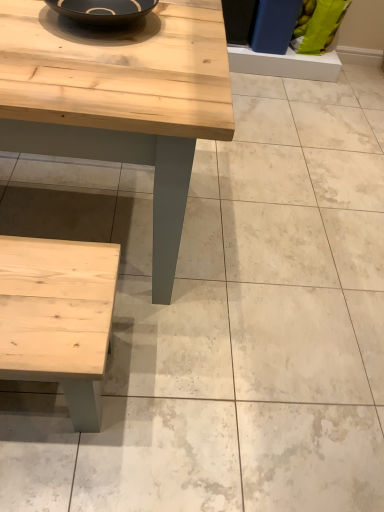
I want to click on free location to the right of natural wood coffee table at center, so click(286, 264).